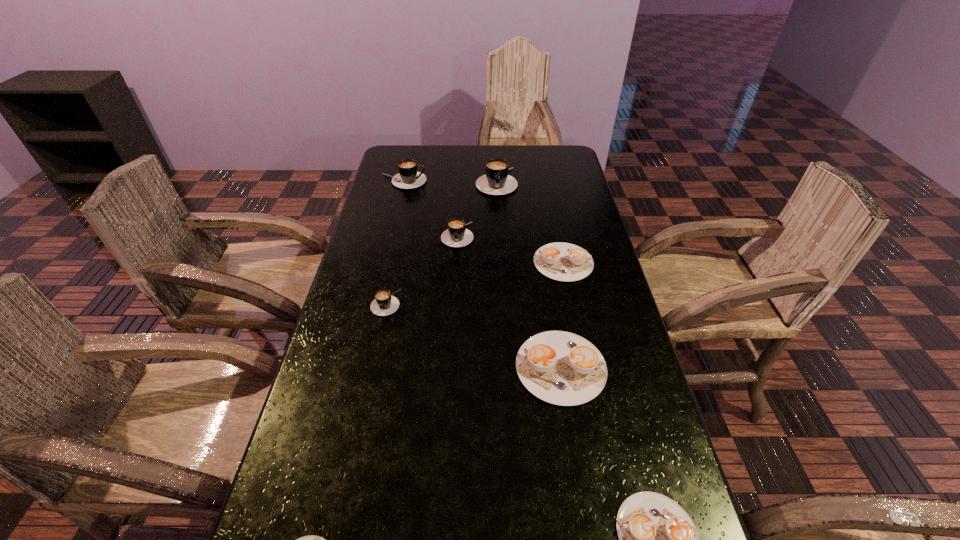
The height and width of the screenshot is (540, 960). Find the location of `vacant region at the left edge of the desktop`. vacant region at the left edge of the desktop is located at coordinates (371, 436).

Identify the location of vacant space at the right edge of the desktop. (570, 220).

This screenshot has width=960, height=540. In the image, there is a desktop. In order to click on vacant region at the far left corner in this screenshot , I will do `click(416, 147)`.

At what (x,y) coordinates should I click in order to perform the action: click on blank space at the far right corner. Please return your answer as a coordinate pair (x, y). This screenshot has height=540, width=960. Looking at the image, I should click on (555, 145).

At what (x,y) coordinates should I click in order to perform the action: click on free space between the tallest object and the sixth tallest cappuccino. Please return your answer as a coordinate pair (x, y). This screenshot has height=540, width=960. Looking at the image, I should click on (530, 222).

The image size is (960, 540). I want to click on blank region between the sixth farthest cappuccino and the second biggest black cappuccino, so click(x=482, y=274).

Locate an element on the screen. The width and height of the screenshot is (960, 540). vacant space that's between the sixth farthest cappuccino and the tallest object is located at coordinates (529, 274).

Where is `free spot between the fourth object from left to right and the tallest object`? free spot between the fourth object from left to right and the tallest object is located at coordinates (477, 208).

The height and width of the screenshot is (540, 960). I want to click on vacant point located between the nearest black cappuccino and the rightmost black cappuccino, so [442, 242].

Find the location of a particular element. This screenshot has height=540, width=960. the sixth closest object relative to the tallest cappuccino is located at coordinates (657, 539).